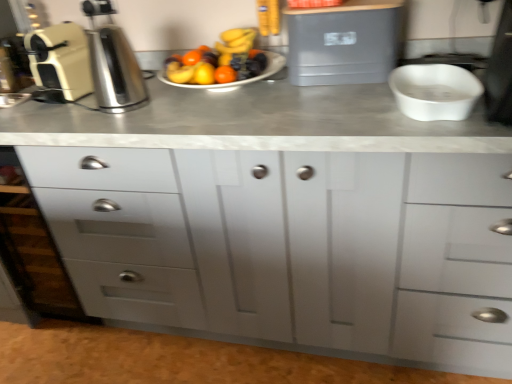
Identify the location of free space in front of satin silver coffee machine at left. The image size is (512, 384). (117, 124).